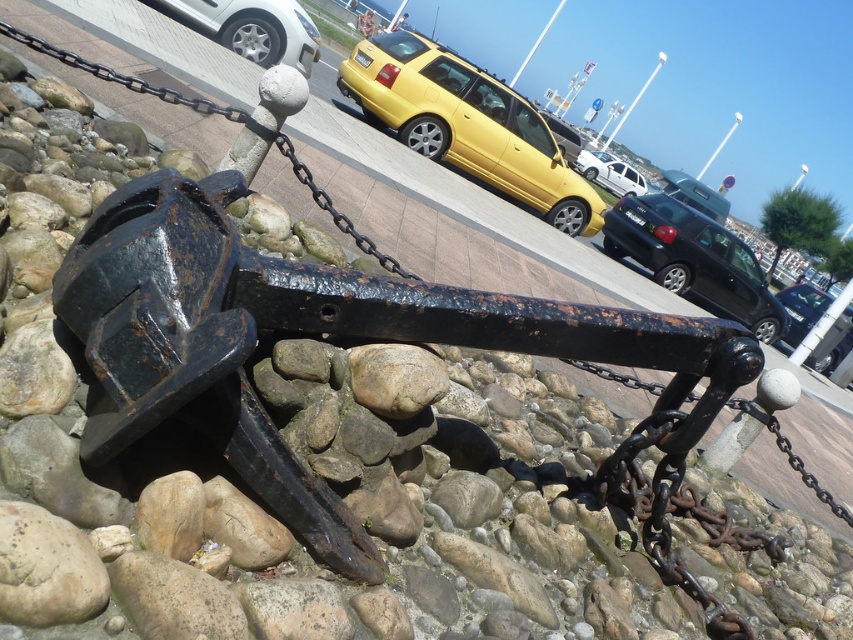
Question: Is silver metallic car at upper left positioned behind rusty metal chain at center?

Choices:
 (A) yes
 (B) no

Answer: (A)

Question: Which of the following is the farthest from the observer?

Choices:
 (A) white matte van at center
 (B) silver metallic car at upper left
 (C) metallic silver car at center
 (D) metallic yellow station wagon at center

Answer: (C)

Question: Which object is positioned farthest from the white matte van at center?

Choices:
 (A) rusty metal chain at center
 (B) metallic silver car at center

Answer: (A)

Question: In this image, where is white matte van at center located relative to metallic silver car at center?

Choices:
 (A) right
 (B) left

Answer: (B)

Question: Is metallic yellow station wagon at center positioned at the back of silver metallic car at upper left?

Choices:
 (A) no
 (B) yes

Answer: (B)

Question: Among these points, which one is farthest from the camera?

Choices:
 (A) (529, 112)
 (B) (821, 292)

Answer: (B)